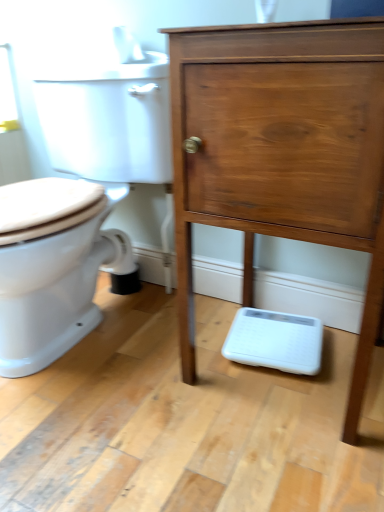
You are a GUI agent. You are given a task and a screenshot of the screen. Output one action in this format:
    pyautogui.click(x=<x>, y=<y>)
    Task: Click on the vacant area that is in front of matte wood chest of drawers at center
    The width and height of the screenshot is (384, 512).
    Given the screenshot: What is the action you would take?
    pyautogui.click(x=268, y=463)